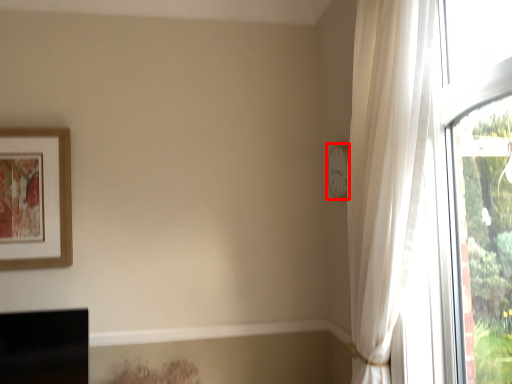
Question: Where is clock (annotated by the red box) located in relation to picture frame in the image?

Choices:
 (A) right
 (B) left

Answer: (A)